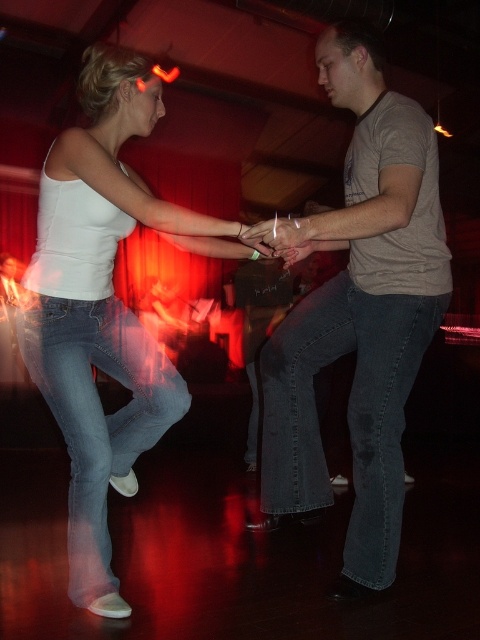
Question: Can you confirm if white matte tank top at upper left is thinner than denim jeans at left?

Choices:
 (A) no
 (B) yes

Answer: (A)

Question: Which object is closer to the camera taking this photo?

Choices:
 (A) matte skin hand at center
 (B) blue denim jeans at center

Answer: (A)

Question: Is blue denim jeans at center below denim jeans at left?

Choices:
 (A) yes
 (B) no

Answer: (B)

Question: Which of the following is the farthest from the observer?

Choices:
 (A) matte skin hand at center
 (B) white matte tank top at upper left

Answer: (B)

Question: Which is nearer to the matte skin hand at center?

Choices:
 (A) white matte tank top at upper left
 (B) denim jeans at left
 (C) blue denim jeans at center

Answer: (A)

Question: Is blue denim jeans at center positioned at the back of denim jeans at left?

Choices:
 (A) yes
 (B) no

Answer: (A)